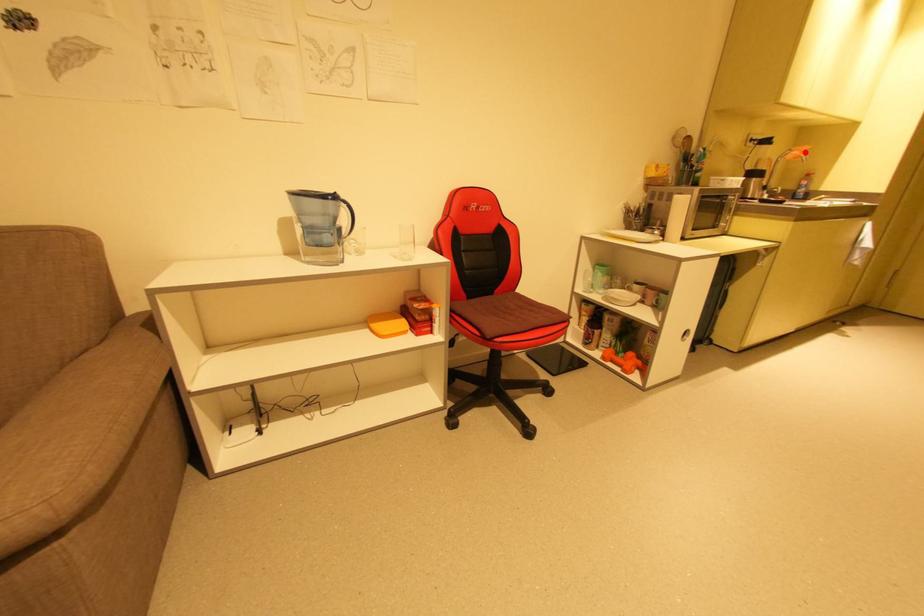
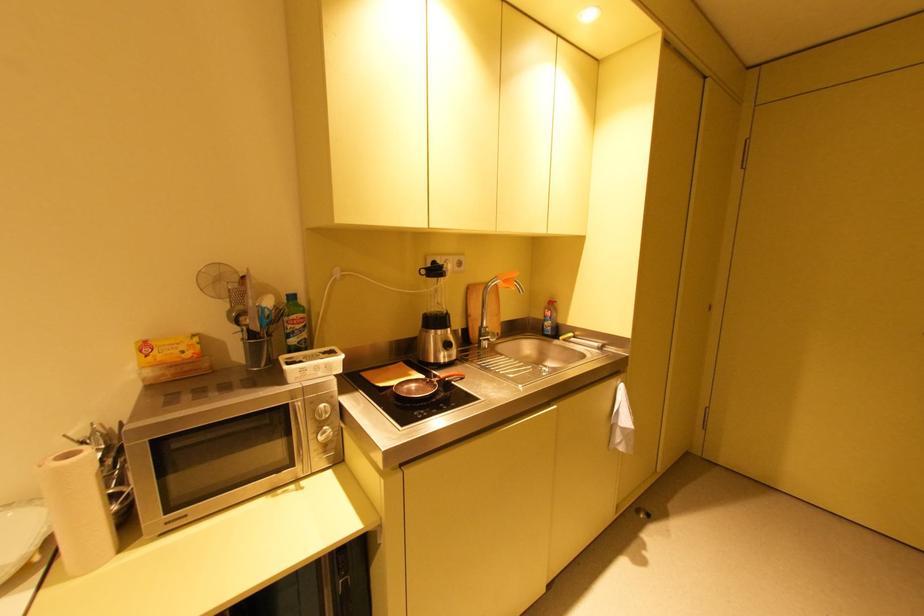
Question: A red point is marked in image1. In image2, is the corresponding 3D point closer to the camera or farther? Reply with the corresponding letter.

Choices:
 (A) The corresponding 3D point is closer.
 (B) The corresponding 3D point is farther.

Answer: (A)